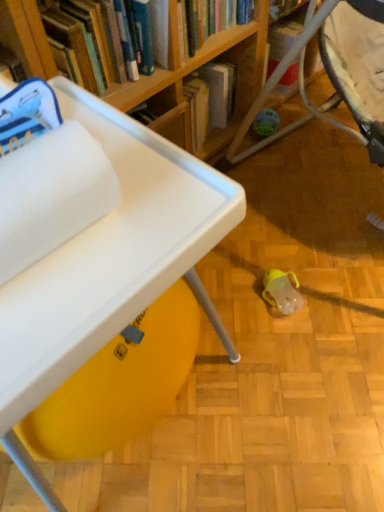
Question: Is wooden bookshelf at upper center directly adjacent to white fluffy towel at upper left?

Choices:
 (A) yes
 (B) no

Answer: (B)

Question: Considering the relative sizes of wooden bookshelf at upper center and white fluffy towel at upper left in the image provided, is wooden bookshelf at upper center shorter than white fluffy towel at upper left?

Choices:
 (A) yes
 (B) no

Answer: (B)

Question: Is wooden bookshelf at upper center located outside white fluffy towel at upper left?

Choices:
 (A) no
 (B) yes

Answer: (B)

Question: Is wooden bookshelf at upper center at the left side of white fluffy towel at upper left?

Choices:
 (A) no
 (B) yes

Answer: (B)

Question: Are wooden bookshelf at upper center and white fluffy towel at upper left located far from each other?

Choices:
 (A) yes
 (B) no

Answer: (B)

Question: From a real-world perspective, is wooden bookshelf at upper center physically located above or below white fluffy towel at upper left?

Choices:
 (A) below
 (B) above

Answer: (A)

Question: Considering the positions of wooden bookshelf at upper center and white fluffy towel at upper left in the image, is wooden bookshelf at upper center taller or shorter than white fluffy towel at upper left?

Choices:
 (A) tall
 (B) short

Answer: (A)

Question: Considering the positions of wooden bookshelf at upper center and white fluffy towel at upper left in the image, is wooden bookshelf at upper center wider or thinner than white fluffy towel at upper left?

Choices:
 (A) thin
 (B) wide

Answer: (B)

Question: Considering their positions, is wooden bookshelf at upper center located in front of or behind white fluffy towel at upper left?

Choices:
 (A) front
 (B) behind

Answer: (B)

Question: From the image's perspective, is white fluffy towel at upper left located above or below wooden bookshelf at upper center?

Choices:
 (A) below
 (B) above

Answer: (A)

Question: From a real-world perspective, relative to wooden bookshelf at upper center, is white fluffy towel at upper left vertically above or below?

Choices:
 (A) below
 (B) above

Answer: (B)

Question: Would you say white fluffy towel at upper left is inside or outside wooden bookshelf at upper center?

Choices:
 (A) outside
 (B) inside

Answer: (A)

Question: Is white fluffy towel at upper left bigger or smaller than wooden bookshelf at upper center?

Choices:
 (A) small
 (B) big

Answer: (A)

Question: Considering the positions of white fluffy towel at upper left and white plastic table at lower left in the image, is white fluffy towel at upper left bigger or smaller than white plastic table at lower left?

Choices:
 (A) small
 (B) big

Answer: (A)

Question: Is white fluffy towel at upper left taller or shorter than white plastic table at lower left?

Choices:
 (A) tall
 (B) short

Answer: (B)